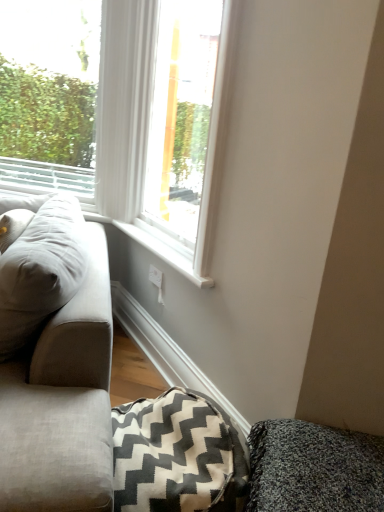
What is the approximate width of white glossy window at center, the second window when ordered from left to right?

11.84 centimeters.

Describe the element at coordinates (177, 455) in the screenshot. I see `gray zigzag-patterned blanket at lower center` at that location.

This screenshot has height=512, width=384. Describe the element at coordinates (56, 364) in the screenshot. I see `light gray fabric couch at left` at that location.

This screenshot has height=512, width=384. What are the coordinates of `white glossy window at center, the second window when ordered from left to right` in the screenshot? It's located at click(x=187, y=124).

From a real-world perspective, does gray zigzag-patterned blanket at lower center stand above white glossy window at center, the second window when ordered from left to right?

Actually, gray zigzag-patterned blanket at lower center is physically below white glossy window at center, the second window when ordered from left to right, in the real world.

Considering the sizes of gray zigzag-patterned blanket at lower center and white glossy window at center, the second window when ordered from left to right, in the image, is gray zigzag-patterned blanket at lower center bigger or smaller than white glossy window at center, the second window when ordered from left to right,?

gray zigzag-patterned blanket at lower center is smaller than white glossy window at center, the second window when ordered from left to right.

Choose the correct answer: Is gray zigzag-patterned blanket at lower center inside white glossy window at center, the second window when ordered from left to right, or outside it?

gray zigzag-patterned blanket at lower center is located beyond the bounds of white glossy window at center, the second window when ordered from left to right.

Considering the sizes of objects gray zigzag-patterned blanket at lower center and white glossy window at center, the second window when ordered from left to right, in the image provided, who is shorter, gray zigzag-patterned blanket at lower center or white glossy window at center, the second window when ordered from left to right,?

gray zigzag-patterned blanket at lower center.

Does point (287, 471) appear closer or farther from the camera than point (164, 466)?

Point (287, 471) is closer to the camera than point (164, 466).

From a real-world perspective, between textured gray cushion at lower right and gray zigzag-patterned blanket at lower center, who is vertically lower?

From a 3D spatial view, gray zigzag-patterned blanket at lower center is below.

Is textured gray cushion at lower right outside of gray zigzag-patterned blanket at lower center?

Indeed, textured gray cushion at lower right is completely outside gray zigzag-patterned blanket at lower center.

Which object is further away from the camera taking this photo, white plastic window at upper left, acting as the second window starting from the right, or white glossy window at center, which is the first window from right to left?

white plastic window at upper left, acting as the second window starting from the right, is more distant.

Considering the relative sizes of white plastic window at upper left, acting as the second window starting from the right, and white glossy window at center, which is the first window from right to left, in the image provided, is white plastic window at upper left, acting as the second window starting from the right, taller than white glossy window at center, which is the first window from right to left,?

Yes.

From the image's perspective, which is below, white plastic window at upper left, the 1th window viewed from the left, or white glossy window at center, which is the first window from right to left?

white glossy window at center, which is the first window from right to left, from the image's perspective.

From the picture: Is white plastic window at upper left, acting as the second window starting from the right, facing towards white glossy window at center, the second window when ordered from left to right?

No.

From the image's perspective, which object appears higher, gray zigzag-patterned blanket at lower center or light gray fabric couch at left?

light gray fabric couch at left is shown above in the image.

Does gray zigzag-patterned blanket at lower center have a greater width compared to light gray fabric couch at left?

No.

Between gray zigzag-patterned blanket at lower center and light gray fabric couch at left, which one is positioned in front?

light gray fabric couch at left.

Between gray zigzag-patterned blanket at lower center and light gray fabric couch at left, which one has larger size?

With larger size is light gray fabric couch at left.

Is point (145, 449) closer to camera compared to point (324, 479)?

No, (145, 449) is behind (324, 479).

Considering the sizes of objects gray zigzag-patterned blanket at lower center and textured gray cushion at lower right in the image provided, who is thinner, gray zigzag-patterned blanket at lower center or textured gray cushion at lower right?

gray zigzag-patterned blanket at lower center.

Would you say gray zigzag-patterned blanket at lower center is a long distance from textured gray cushion at lower right?

They are positioned close to each other.

In terms of height, does gray zigzag-patterned blanket at lower center look taller or shorter compared to textured gray cushion at lower right?

In the image, gray zigzag-patterned blanket at lower center appears to be shorter than textured gray cushion at lower right.

Is light gray fabric couch at left surrounded by textured gray cushion at lower right?

No, light gray fabric couch at left is not inside textured gray cushion at lower right.

Between textured gray cushion at lower right and light gray fabric couch at left, which one has less height?

Standing shorter between the two is textured gray cushion at lower right.

Can you confirm if textured gray cushion at lower right is bigger than light gray fabric couch at left?

Actually, textured gray cushion at lower right might be smaller than light gray fabric couch at left.

Could you tell me if white painted wood at lower center is facing white plastic window at upper left, acting as the second window starting from the right?

No, white painted wood at lower center is not turned towards white plastic window at upper left, acting as the second window starting from the right.

Measure the distance from white painted wood at lower center to white plastic window at upper left, acting as the second window starting from the right.

1.53 meters.

Considering the relative positions of white painted wood at lower center and white plastic window at upper left, the 1th window viewed from the left, in the image provided, is white painted wood at lower center in front of white plastic window at upper left, the 1th window viewed from the left,?

That is True.

Between white painted wood at lower center and white plastic window at upper left, acting as the second window starting from the right, which one has more height?

white plastic window at upper left, acting as the second window starting from the right.

Locate an element on the screen. This screenshot has height=512, width=384. window that is the 1st one when counting leftward from the gray zigzag-patterned blanket at lower center is located at coordinates (187, 124).

You are a GUI agent. You are given a task and a screenshot of the screen. Output one action in this format:
    pyautogui.click(x=<x>, y=<y>)
    Task: Click on the blanket below the textured gray cushion at lower right (from a real-world perspective)
    
    Given the screenshot: What is the action you would take?
    pyautogui.click(x=177, y=455)

Estimate the real-world distances between objects in this image. Which object is further from gray zigzag-patterned blanket at lower center, light gray fabric couch at left or white painted wood at lower center?

Among the two, white painted wood at lower center is located further to gray zigzag-patterned blanket at lower center.

Looking at the image, which one is located closer to gray zigzag-patterned blanket at lower center, light gray fabric couch at left or white glossy window at center, the second window when ordered from left to right?

The object closer to gray zigzag-patterned blanket at lower center is light gray fabric couch at left.

Estimate the real-world distances between objects in this image. Which object is further from white plastic window at upper left, the 1th window viewed from the left, light gray fabric couch at left or textured gray cushion at lower right?

textured gray cushion at lower right.

Based on their spatial positions, is light gray fabric couch at left or white plastic window at upper left, acting as the second window starting from the right, further from white glossy window at center, which is the first window from right to left?

Based on the image, white plastic window at upper left, acting as the second window starting from the right, appears to be further to white glossy window at center, which is the first window from right to left.

From the image, which object appears to be nearer to white plastic window at upper left, the 1th window viewed from the left, textured gray cushion at lower right or light gray fabric couch at left?

The object closer to white plastic window at upper left, the 1th window viewed from the left, is light gray fabric couch at left.

Based on their spatial positions, is textured gray cushion at lower right or gray zigzag-patterned blanket at lower center further from white glossy window at center, the second window when ordered from left to right?

textured gray cushion at lower right lies further to white glossy window at center, the second window when ordered from left to right, than the other object.

Estimate the real-world distances between objects in this image. Which object is closer to white painted wood at lower center, white glossy window at center, the second window when ordered from left to right, or gray zigzag-patterned blanket at lower center?

white glossy window at center, the second window when ordered from left to right, is positioned closer to the anchor white painted wood at lower center.

From the image, which object appears to be farther from white glossy window at center, which is the first window from right to left, gray zigzag-patterned blanket at lower center or textured gray cushion at lower right?

textured gray cushion at lower right is positioned further to the anchor white glossy window at center, which is the first window from right to left.

Find the location of a particular element. The width and height of the screenshot is (384, 512). studio couch that lies between white glossy window at center, which is the first window from right to left, and gray zigzag-patterned blanket at lower center from top to bottom is located at coordinates [x=56, y=364].

In order to click on window between light gray fabric couch at left and white painted wood at lower center from front to back in this screenshot , I will do `click(187, 124)`.

Where is `window between white plastic window at upper left, the 1th window viewed from the left, and textured gray cushion at lower right from top to bottom`? Image resolution: width=384 pixels, height=512 pixels. window between white plastic window at upper left, the 1th window viewed from the left, and textured gray cushion at lower right from top to bottom is located at coordinates tap(187, 124).

Image resolution: width=384 pixels, height=512 pixels. I want to click on window sill between white plastic window at upper left, acting as the second window starting from the right, and gray zigzag-patterned blanket at lower center vertically, so click(164, 253).